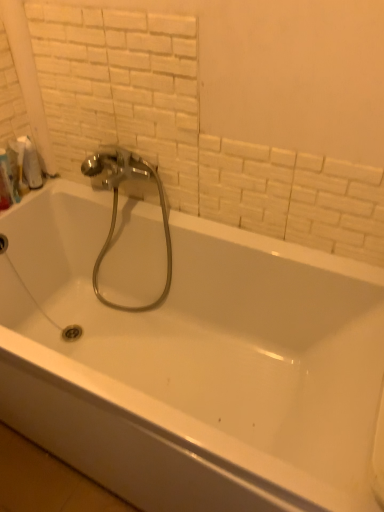
Measure the distance between point [8,170] and camera.

Point [8,170] and camera are 1.43 meters apart from each other.

You are a GUI agent. You are given a task and a screenshot of the screen. Output one action in this format:
    pyautogui.click(x=<x>, y=<y>)
    Task: Click on the white plastic bottle at upper left
    The height and width of the screenshot is (512, 384).
    Given the screenshot: What is the action you would take?
    pyautogui.click(x=6, y=183)

At what (x,y) coordinates should I click in order to perform the action: click on polished chrome faucet at upper center. Please return your answer as a coordinate pair (x, y). The height and width of the screenshot is (512, 384). Looking at the image, I should click on (117, 207).

Does white matte toilet paper at upper left have a greater height compared to polished chrome faucet at upper center?

Incorrect, the height of white matte toilet paper at upper left is not larger of that of polished chrome faucet at upper center.

Consider the image. Who is bigger, white matte toilet paper at upper left or polished chrome faucet at upper center?

polished chrome faucet at upper center is bigger.

Between white matte toilet paper at upper left and polished chrome faucet at upper center, which one appears on the right side from the viewer's perspective?

polished chrome faucet at upper center is more to the right.

From a real-world perspective, is white matte toilet paper at upper left on polished chrome faucet at upper center?

Yes, from a real-world perspective, white matte toilet paper at upper left is over polished chrome faucet at upper center

Which of these two, white glossy bathtub at center or white plastic bottle at upper left, is bigger?

Bigger between the two is white glossy bathtub at center.

Which of these two, white glossy bathtub at center or white plastic bottle at upper left, stands taller?

With more height is white glossy bathtub at center.

In the image, there is a white plastic bottle at upper left. Identify the location of bathtub below it (from the image's perspective). (189, 356).

Image resolution: width=384 pixels, height=512 pixels. In order to click on toiletry that is behind the polished chrome faucet at upper center in this screenshot , I will do point(6,183).

Between polished chrome faucet at upper center and white plastic bottle at upper left, which one appears on the left side from the viewer's perspective?

white plastic bottle at upper left.

Can you tell me how much polished chrome faucet at upper center and white plastic bottle at upper left differ in facing direction?

90.5 degrees.

Looking at this image, based on their sizes in the image, would you say polished chrome faucet at upper center is bigger or smaller than white plastic bottle at upper left?

In the image, polished chrome faucet at upper center appears to be larger than white plastic bottle at upper left.

Is polished chrome faucet at upper center completely or partially outside of white glossy bathtub at center?

No.

From a real-world perspective, relative to white glossy bathtub at center, is polished chrome faucet at upper center vertically above or below?

polished chrome faucet at upper center is above white glossy bathtub at center.

From the image's perspective, is polished chrome faucet at upper center located above or below white glossy bathtub at center?

polished chrome faucet at upper center is situated higher than white glossy bathtub at center in the image.

Identify the location of bathtub that appears in front of the polished chrome faucet at upper center. (189, 356).

In terms of width, does white plastic bottle at upper left look wider or thinner when compared to white glossy bathtub at center?

In the image, white plastic bottle at upper left appears to be more narrow than white glossy bathtub at center.

How distant is white plastic bottle at upper left from white glossy bathtub at center?

white plastic bottle at upper left and white glossy bathtub at center are 28.57 inches apart.

From the image's perspective, which one is positioned lower, white plastic bottle at upper left or white glossy bathtub at center?

From the image's view, white glossy bathtub at center is below.

Consider the image. From a real-world perspective, does white plastic bottle at upper left sit lower than white glossy bathtub at center?

No, from a real-world perspective, white plastic bottle at upper left is not beneath white glossy bathtub at center.

Does white matte toilet paper at upper left have a greater height compared to white glossy bathtub at center?

Incorrect, the height of white matte toilet paper at upper left is not larger of that of white glossy bathtub at center.

Would you say white matte toilet paper at upper left contains white glossy bathtub at center?

Definitely not — white glossy bathtub at center is not inside white matte toilet paper at upper left.

Does white matte toilet paper at upper left come in front of white glossy bathtub at center?

No, white matte toilet paper at upper left is behind white glossy bathtub at center.

Does point (35, 147) lie in front of point (10, 225)?

No, (35, 147) is further to viewer.

Considering the relative positions of white glossy bathtub at center and white matte toilet paper at upper left in the image provided, is white glossy bathtub at center in front of white matte toilet paper at upper left?

That is True.

Based on their sizes in the image, would you say white glossy bathtub at center is bigger or smaller than white matte toilet paper at upper left?

Considering their sizes, white glossy bathtub at center takes up more space than white matte toilet paper at upper left.

Choose the correct answer: Is white glossy bathtub at center inside white matte toilet paper at upper left or outside it?

white glossy bathtub at center is spatially situated outside white matte toilet paper at upper left.

Looking at this image, how different are the orientations of white glossy bathtub at center and white matte toilet paper at upper left in degrees?

The angular difference between white glossy bathtub at center and white matte toilet paper at upper left is 90.5 degrees.

You are a GUI agent. You are given a task and a screenshot of the screen. Output one action in this format:
    pyautogui.click(x=<x>, y=<y>)
    Task: Click on the plumbing fixture below the white matte toilet paper at upper left (from a real-world perspective)
    The height and width of the screenshot is (512, 384).
    Given the screenshot: What is the action you would take?
    pyautogui.click(x=117, y=207)

I want to click on bathtub that appears below the white plastic bottle at upper left (from the image's perspective), so click(x=189, y=356).

Which object lies nearer to the anchor point polished chrome faucet at upper center, white glossy bathtub at center or white plastic bottle at upper left?

Among the two, white glossy bathtub at center is located nearer to polished chrome faucet at upper center.

Which object lies further to the anchor point white glossy bathtub at center, white matte toilet paper at upper left or white plastic bottle at upper left?

The object further to white glossy bathtub at center is white matte toilet paper at upper left.

When comparing their distances from white matte toilet paper at upper left, does polished chrome faucet at upper center or white glossy bathtub at center seem further?

white glossy bathtub at center lies further to white matte toilet paper at upper left than the other object.

When comparing their distances from white matte toilet paper at upper left, does polished chrome faucet at upper center or white plastic bottle at upper left seem further?

polished chrome faucet at upper center.

Consider the image. Estimate the real-world distances between objects in this image. Which object is closer to polished chrome faucet at upper center, white matte toilet paper at upper left or white glossy bathtub at center?

white matte toilet paper at upper left lies closer to polished chrome faucet at upper center than the other object.

From the image, which object appears to be nearer to white glossy bathtub at center, polished chrome faucet at upper center or white plastic bottle at upper left?

polished chrome faucet at upper center lies closer to white glossy bathtub at center than the other object.

Estimate the real-world distances between objects in this image. Which object is closer to white plastic bottle at upper left, white glossy bathtub at center or polished chrome faucet at upper center?

polished chrome faucet at upper center is positioned closer to the anchor white plastic bottle at upper left.

Looking at this image, considering their positions, is white plastic bottle at upper left positioned further to white matte toilet paper at upper left than white glossy bathtub at center?

Based on the image, white glossy bathtub at center appears to be further to white matte toilet paper at upper left.

Where is `toiletry between white glossy bathtub at center and white matte toilet paper at upper left from front to back`? The width and height of the screenshot is (384, 512). toiletry between white glossy bathtub at center and white matte toilet paper at upper left from front to back is located at coordinates (6, 183).

Identify the location of toilet paper between white plastic bottle at upper left and polished chrome faucet at upper center from left to right. The height and width of the screenshot is (512, 384). (30, 163).

I want to click on plumbing fixture positioned between white glossy bathtub at center and white plastic bottle at upper left from near to far, so click(117, 207).

Where is `plumbing fixture located between white glossy bathtub at center and white matte toilet paper at upper left in the depth direction`? plumbing fixture located between white glossy bathtub at center and white matte toilet paper at upper left in the depth direction is located at coordinates (117, 207).